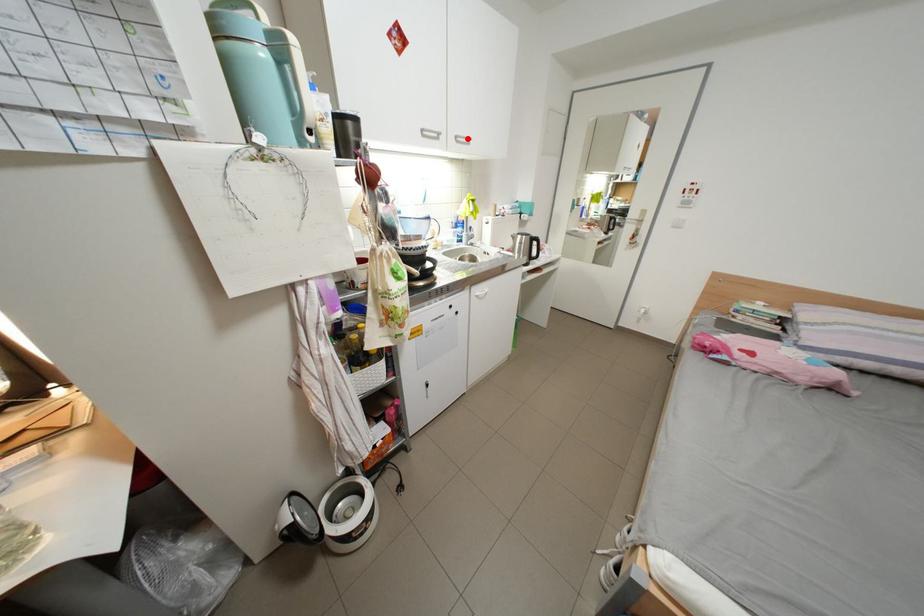
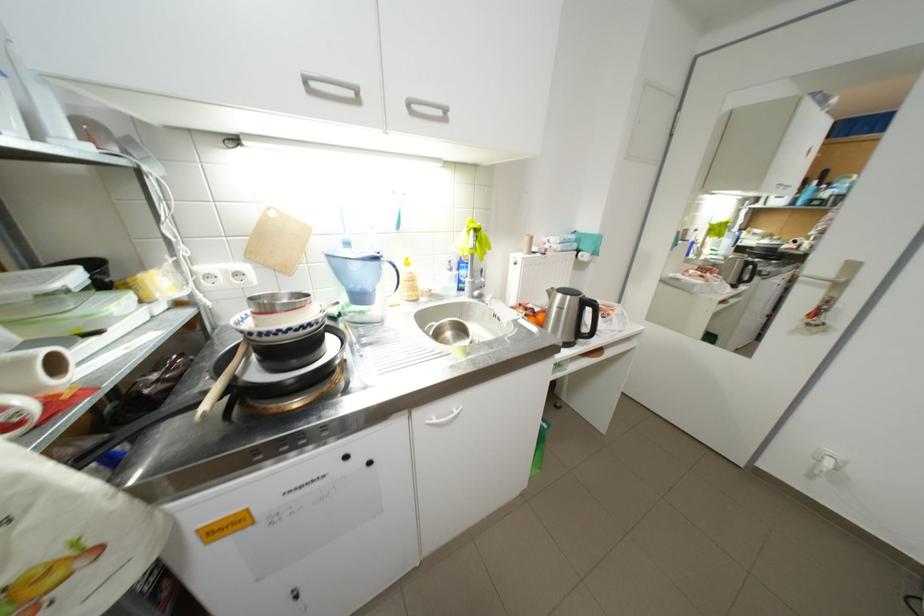
Find the pixel in the second image that matches the highlighted location in the first image.

(420, 105)